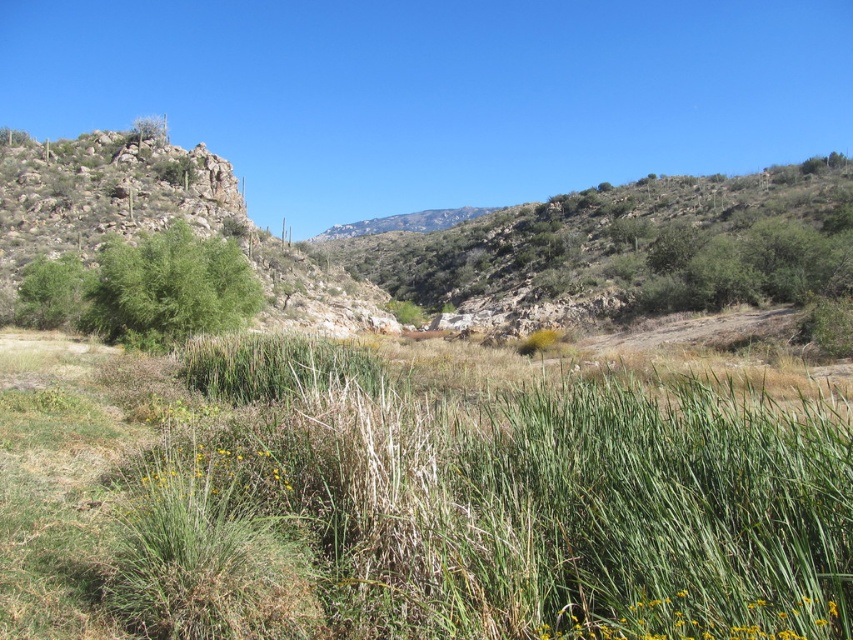
Question: Among these objects, which one is nearest to the camera?

Choices:
 (A) green grassy at center
 (B) green leafy bush at left
 (C) yellow-green grass at lower right

Answer: (C)

Question: In this image, where is green grassy at center located relative to yellow-green grass at lower right?

Choices:
 (A) above
 (B) below

Answer: (A)

Question: Which object is closer to the camera taking this photo?

Choices:
 (A) yellow-green grass at lower right
 (B) green grassy at center
 (C) green leafy bush at left

Answer: (A)

Question: Is green leafy bush at left positioned at the back of yellow-green grass at lower right?

Choices:
 (A) no
 (B) yes

Answer: (B)

Question: Which point is closer to the camera taking this photo?

Choices:
 (A) (213, 326)
 (B) (842, 499)

Answer: (B)

Question: Is green leafy bush at left wider than yellow-green grass at lower right?

Choices:
 (A) yes
 (B) no

Answer: (A)